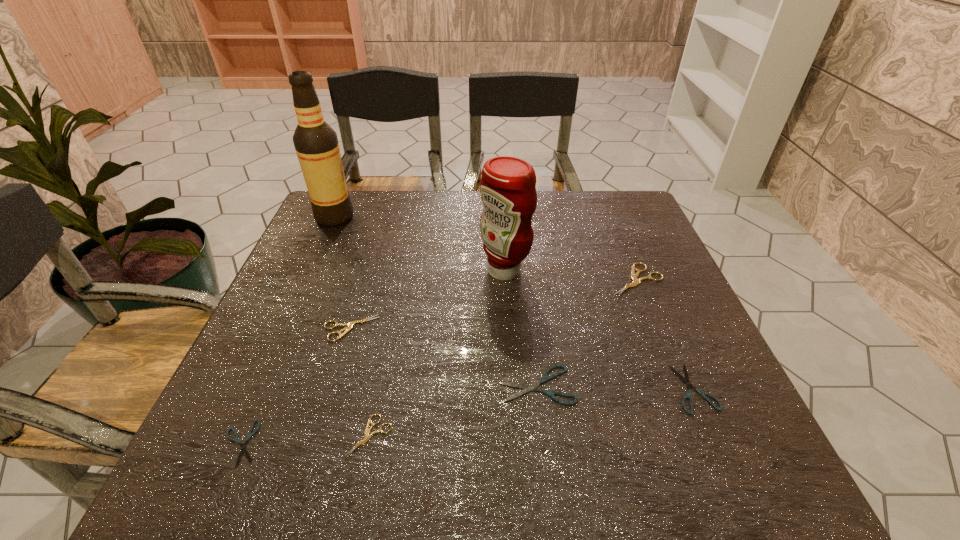
Locate an element on the screen. The width and height of the screenshot is (960, 540). beige alcohol is located at coordinates (316, 143).

You are a GUI agent. You are given a task and a screenshot of the screen. Output one action in this format:
    pyautogui.click(x=<x>, y=<y>)
    Task: Click on the tallest object
    
    Given the screenshot: What is the action you would take?
    pyautogui.click(x=316, y=143)

This screenshot has width=960, height=540. I want to click on red condiment, so click(508, 185).

You are a GUI agent. You are given a task and a screenshot of the screen. Output one action in this format:
    pyautogui.click(x=<x>, y=<y>)
    Task: Click on the condiment
    
    Given the screenshot: What is the action you would take?
    pyautogui.click(x=508, y=185)

You are a GUI agent. You are given a task and a screenshot of the screen. Output one action in this format:
    pyautogui.click(x=<x>, y=<y>)
    Task: Click on the farthest shears
    The width and height of the screenshot is (960, 540).
    Given the screenshot: What is the action you would take?
    pyautogui.click(x=634, y=276)

At what (x,y) coordinates should I click in order to perform the action: click on the farthest beige shears. Please return your answer as a coordinate pair (x, y). This screenshot has height=540, width=960. Looking at the image, I should click on (634, 276).

Identify the location of the fourth tallest object. The width and height of the screenshot is (960, 540). (350, 325).

Locate an element on the screen. Image resolution: width=960 pixels, height=540 pixels. the second biggest beige shears is located at coordinates (350, 325).

Identify the location of the fourth shears from left to right. (527, 388).

The height and width of the screenshot is (540, 960). I want to click on the second black shears from left to right, so click(527, 388).